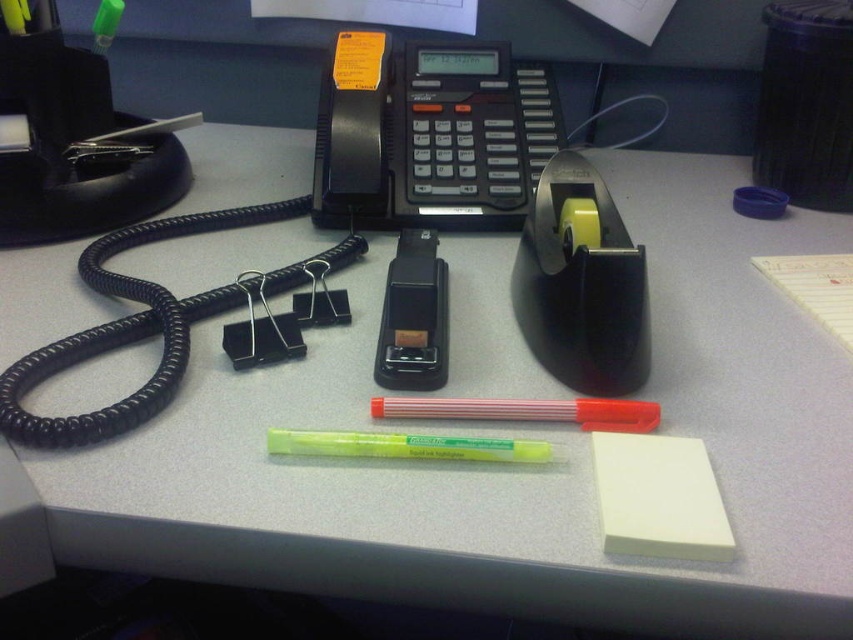
You are organizing the desk items and need to place the black plastic phone at center and the yellow highlighter at center into a drawer. The drawer has a height limit of 10 cm. Can both items fit vertically without bending or damaging them?

The black plastic phone at center is taller than the yellow highlighter at center. Since the drawer has a height limit of 10 cm, we need to know the exact heights of both items. However, the description only states their relative sizes. Without specific measurements, we cannot definitively determine if both will fit. Please check the actual dimensions of each item.

You are organizing the desk items and need to place the translucent red highlighter at center in a specific location. According to the coordinates provided, where exactly should you place it?

The translucent red highlighter at center should be placed at the coordinates point (527, 412).

You are organizing items on the desk and need to place a new item between the black plastic phone at center and the yellow highlighter at center. Which item should be placed closer to you to maintain the existing spatial arrangement?

The black plastic phone at center is closer to you than the yellow highlighter at center, so the new item should be placed closer to the yellow highlighter at center to maintain the existing spatial arrangement.